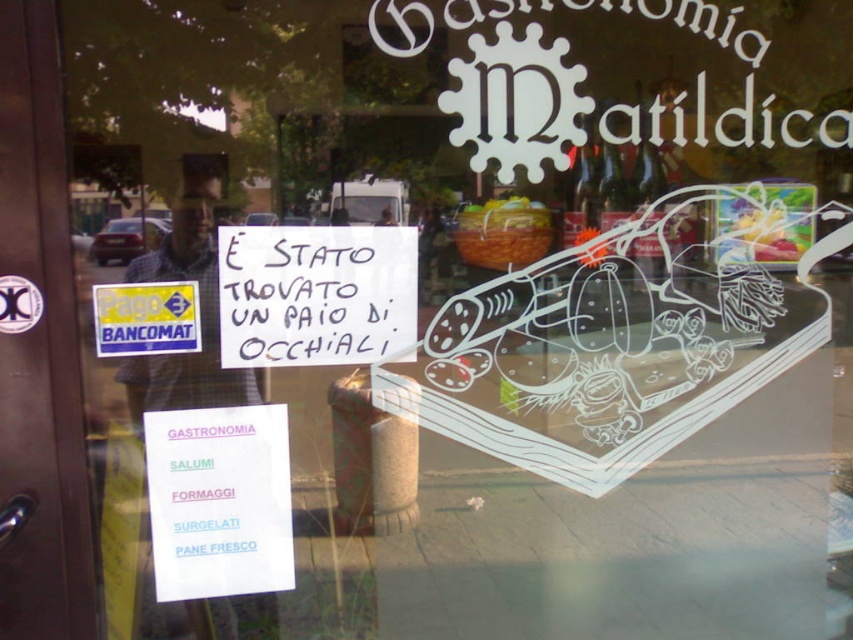
Question: Which point is farther to the camera?

Choices:
 (A) brown wooden door at left
 (B) white handwritten sign at center
 (C) white paper sign at lower left

Answer: (C)

Question: Does brown wooden door at left appear over white handwritten sign at center?

Choices:
 (A) yes
 (B) no

Answer: (B)

Question: Can you confirm if brown wooden door at left is smaller than white paper sign at lower left?

Choices:
 (A) no
 (B) yes

Answer: (A)

Question: Which object is farther from the camera taking this photo?

Choices:
 (A) white handwritten sign at center
 (B) brown wooden door at left
 (C) white paper sign at lower left

Answer: (C)

Question: Which of the following is the closest to the observer?

Choices:
 (A) (28, 122)
 (B) (254, 582)

Answer: (A)

Question: Does white handwritten sign at center have a lesser width compared to white paper sign at lower left?

Choices:
 (A) no
 (B) yes

Answer: (A)